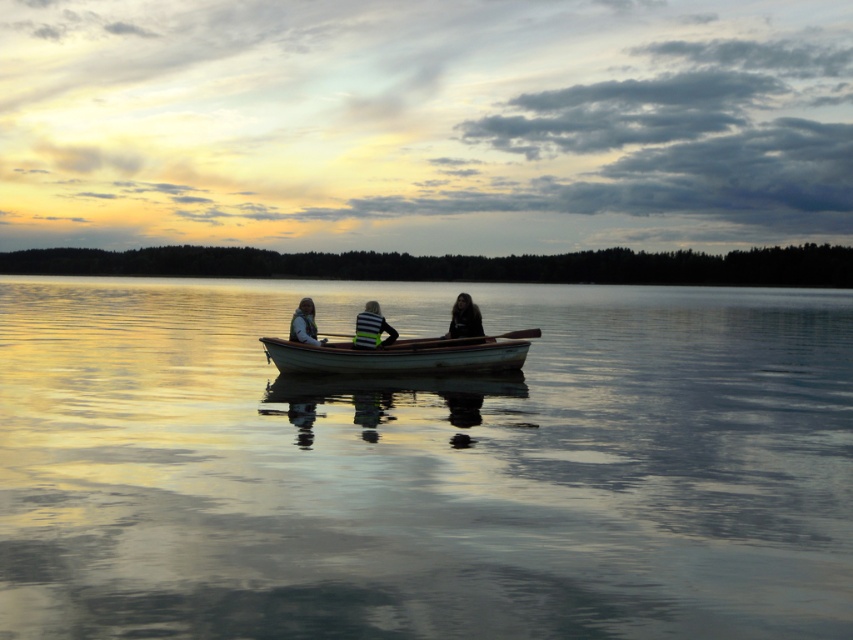
Question: Observing the image, what is the correct spatial positioning of wooden canoe at center in reference to matte black life vest at center?

Choices:
 (A) above
 (B) below

Answer: (B)

Question: Which object appears closest to the camera in this image?

Choices:
 (A) striped fabric shirt at center
 (B) dark hair at center
 (C) matte white boat at center

Answer: (A)

Question: Which point is farther from the camera taking this photo?

Choices:
 (A) (465, 365)
 (B) (849, 490)
 (C) (375, 312)
 (D) (456, 301)

Answer: (D)

Question: Does matte white boat at center have a greater width compared to matte black life vest at center?

Choices:
 (A) yes
 (B) no

Answer: (A)

Question: Is wooden canoe at center below matte white boat at center?

Choices:
 (A) yes
 (B) no

Answer: (A)

Question: Which is farther from the dark hair at center?

Choices:
 (A) matte black life vest at center
 (B) striped fabric shirt at center

Answer: (A)